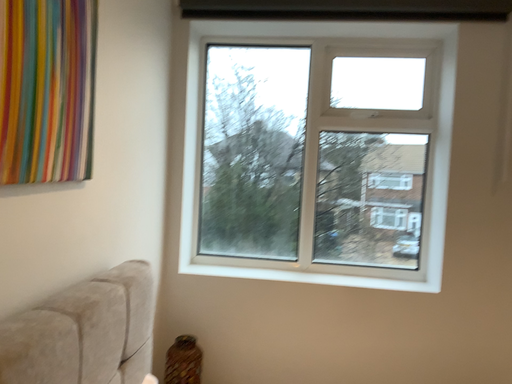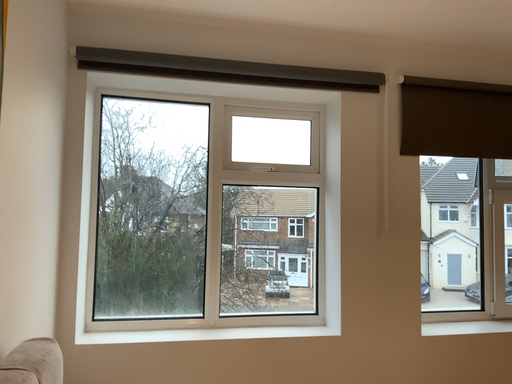
Question: Which way did the camera rotate in the video?

Choices:
 (A) rotated right
 (B) rotated left

Answer: (A)